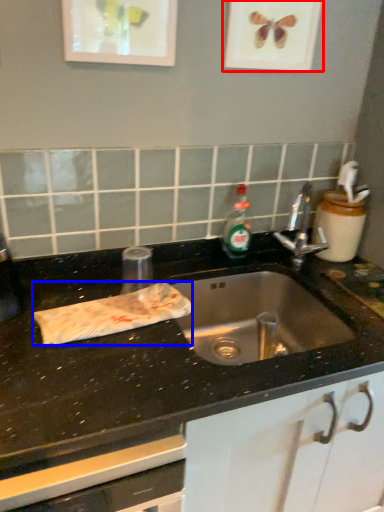
Question: Which object appears farthest to the camera in this image, picture frame (highlighted by a red box) or material (highlighted by a blue box)?

Choices:
 (A) picture frame
 (B) material

Answer: (A)